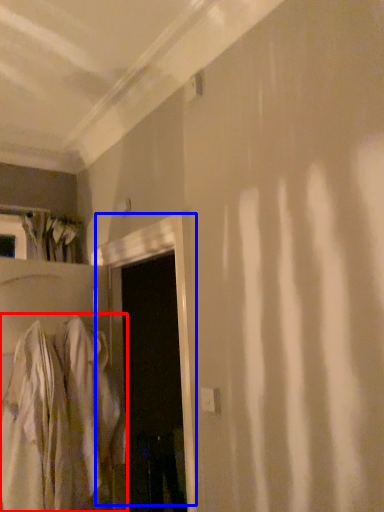
Question: Which point is closer to the camera, robe (highlighted by a red box) or door (highlighted by a blue box)?

Choices:
 (A) robe
 (B) door

Answer: (B)